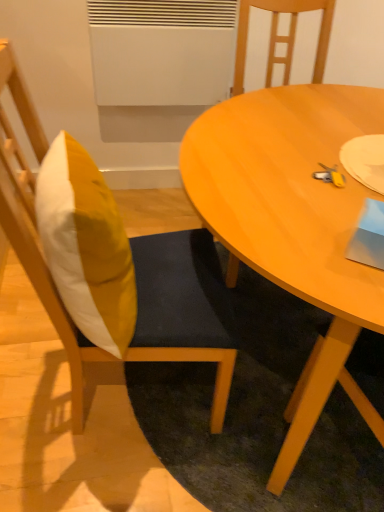
Where is `empty space that is ontop of light brown wooden table at center (from a real-world perspective)`? The height and width of the screenshot is (512, 384). empty space that is ontop of light brown wooden table at center (from a real-world perspective) is located at coordinates (317, 159).